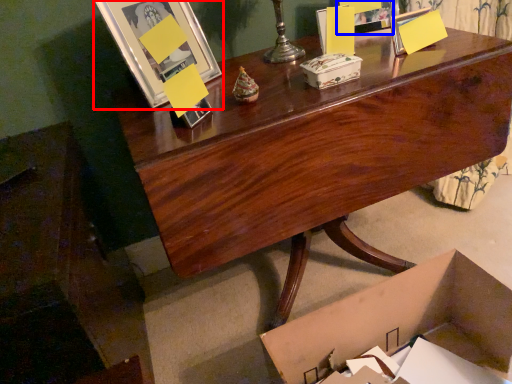
Question: Among these objects, which one is farthest to the camera, picture frame (highlighted by a red box) or picture frame (highlighted by a blue box)?

Choices:
 (A) picture frame
 (B) picture frame

Answer: (B)